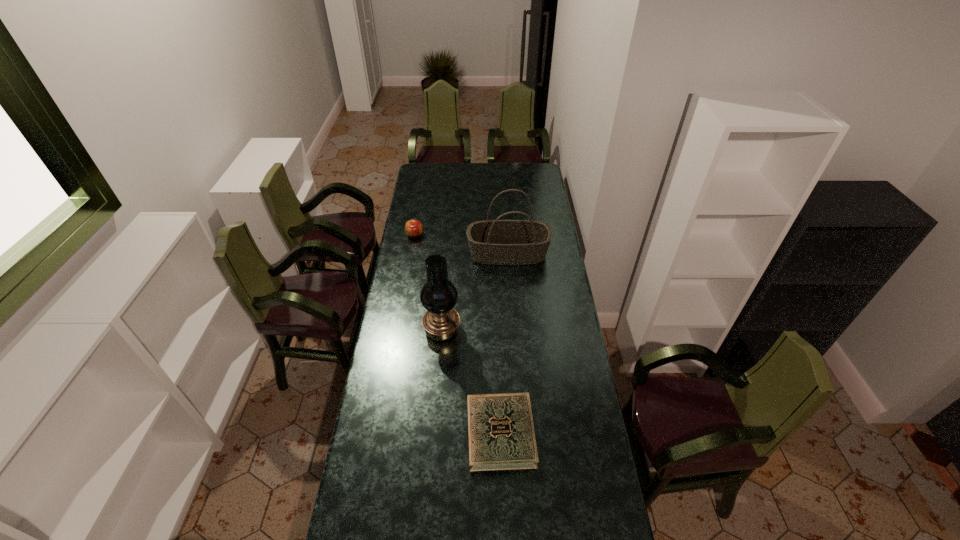
The height and width of the screenshot is (540, 960). In order to click on free space between the hardback book and the leftmost object in this screenshot , I will do `click(458, 334)`.

At what (x,y) coordinates should I click in order to perform the action: click on vacant area between the leftmost object and the nearest object. Please return your answer as a coordinate pair (x, y). Image resolution: width=960 pixels, height=540 pixels. Looking at the image, I should click on (458, 334).

The image size is (960, 540). In order to click on vacant point located between the shortest object and the basket in this screenshot , I will do `click(504, 343)`.

Where is `vacant space that's between the nearest object and the farthest object`? This screenshot has height=540, width=960. vacant space that's between the nearest object and the farthest object is located at coordinates (458, 334).

Identify the location of the third closest object to the oil lamp. (413, 228).

Locate which object is the second closest to the farthest object. Please provide its 2D coordinates. Your answer should be formatted as a tuple, i.e. [(x, y)], where the tuple contains the x and y coordinates of a point satisfying the conditions above.

[(441, 322)]